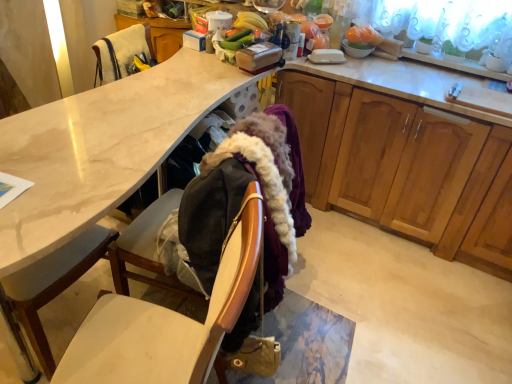
Identify the location of free space above matte white desk at center (from a real-world perspective). (142, 105).